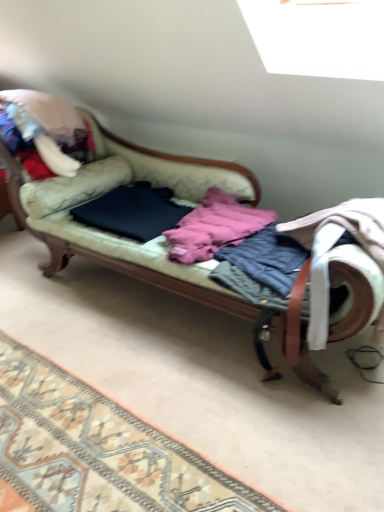
Locate an element on the screen. free point below patterned carpet at lower left (from a real-world perspective) is located at coordinates (88, 445).